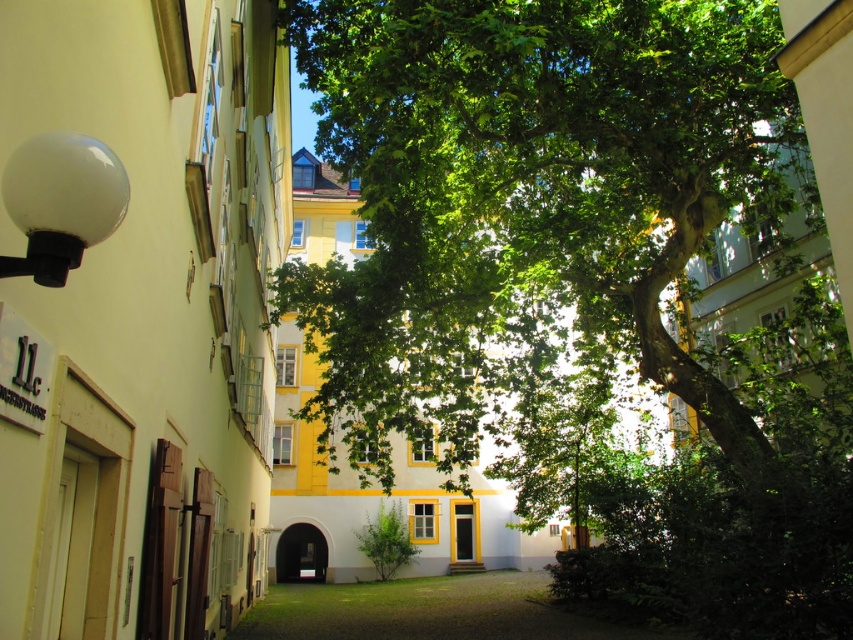
Based on the photo, you are standing in the courtyard and want to sit on the green grass at center. Which direction should you move from the green leafy tree at center to reach the grass?

You should move to the left from the green leafy tree at center to reach the green grass at center because the tree is to the right of the grass.

You are standing in the courtyard and want to walk to the green grass at center. Which direction should you walk to avoid the green leafy tree at center?

Since the green leafy tree at center is in front of the green grass at center, you should walk around the tree to reach the green grass at center without going through it.

You are planning to place a small garden bench in the courtyard. The bench requires a 6 meter gap between the green leafy tree at center and the green grass at center to be placed safely. Based on the scene, is there enough space between them for the bench?

The green leafy tree at center and the green grass at center are 5.74 meters apart. Since the required space is 6 meters, there isn not enough space to place the bench safely between them.